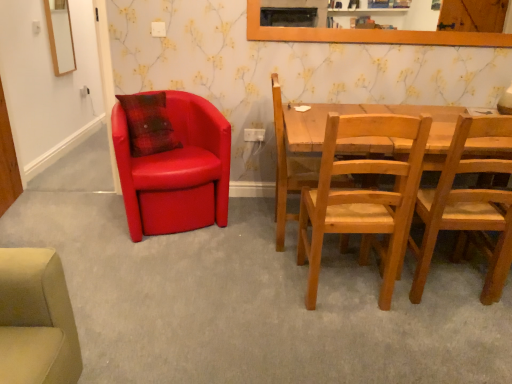
The width and height of the screenshot is (512, 384). Find the location of `free space in front of matte leather chair at left, the 4th chair from the right`. free space in front of matte leather chair at left, the 4th chair from the right is located at coordinates (160, 263).